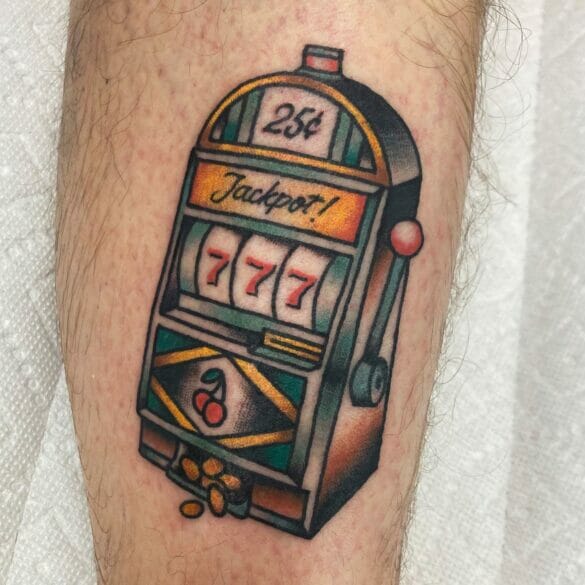
Where is `handle`? The height and width of the screenshot is (585, 585). handle is located at coordinates (371, 342).